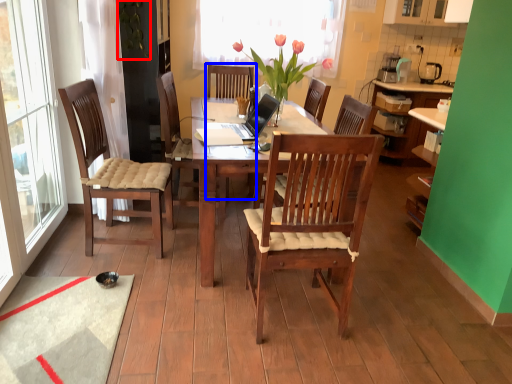
Question: Among these objects, which one is nearest to the camera, plant (highlighted by a red box) or armchair (highlighted by a blue box)?

Choices:
 (A) plant
 (B) armchair

Answer: (A)